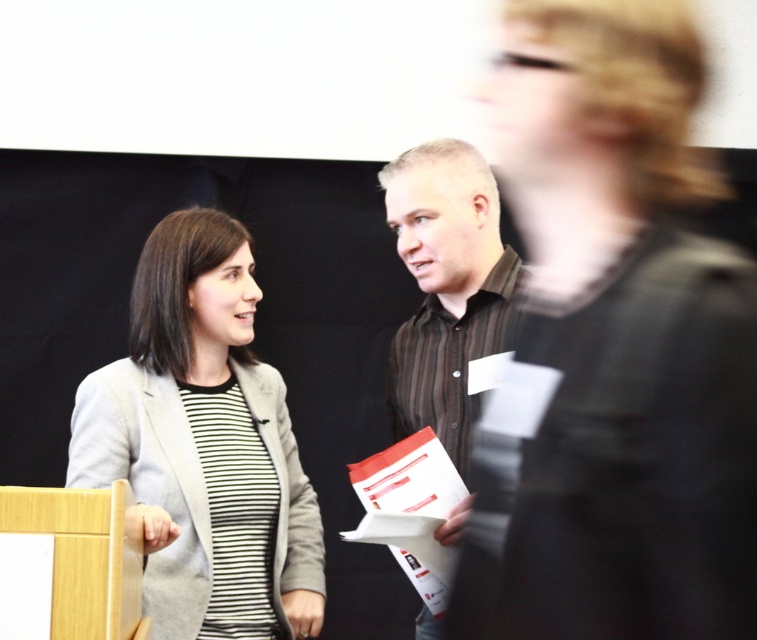
You are standing in the middle of the room and want to find the matte gray blazer at center. Which direction should you look to find it?

You should look towards the point at coordinate 0.695 on the x axis and 0.271 on the y axis to find the matte gray blazer at center.

You are a photographer at the event and need to capture a closeup shot of both the matte gray blazer at center and the brown striped shirt at center without any distortion. Given that your camera lens has a minimum focusing distance of 14 inches, will you be able to achieve this?

The matte gray blazer at center is 14.12 inches away from the brown striped shirt at center. Since the minimum focusing distance of the camera lens is 14 inches, the photographer can achieve the closeup shot as the distance between the two objects is slightly more than the required minimum focusing distance.

You are standing at the point labeled as point (293, 600) in the image. You want to move to the nearest exit, which is located 10 feet away from your current position. Can you safely walk straight ahead without any obstacles in your path? Please consider the distance between you and the exit as well as any potential obstructions mentioned in the scene description.

The point labeled (293, 600) is 6.40 feet away from the viewer. Since the nearest exit is 10 feet away, the distance between them is 3.6 feet. However, the scene description does not mention any obstacles between the point and the exit, so it should be safe to walk straight ahead.